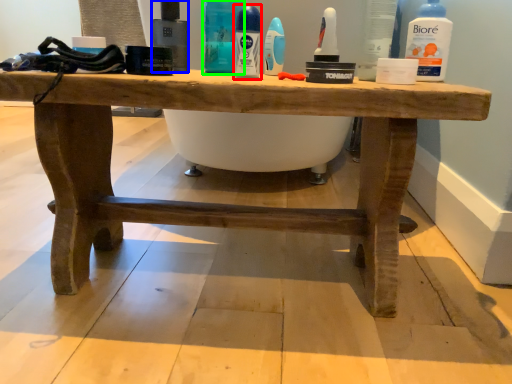
Question: Based on their relative distances, which object is farther from mouthwash (highlighted by a red box)? Choose from mouthwash (highlighted by a blue box) and cleaning product (highlighted by a green box).

Choices:
 (A) mouthwash
 (B) cleaning product

Answer: (A)